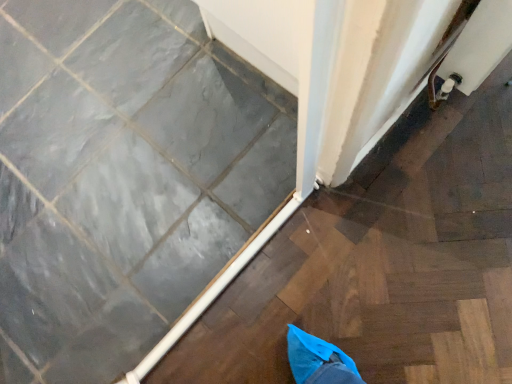
You are a GUI agent. You are given a task and a screenshot of the screen. Output one action in this format:
    pyautogui.click(x=<x>, y=<y>)
    Task: Click on the slate gray ceramic tile at lower left
    The width and height of the screenshot is (512, 384).
    Given the screenshot: What is the action you would take?
    pyautogui.click(x=123, y=178)

The width and height of the screenshot is (512, 384). Describe the element at coordinates (123, 178) in the screenshot. I see `slate gray ceramic tile at lower left` at that location.

What do you see at coordinates (384, 262) in the screenshot? This screenshot has height=384, width=512. I see `white glossy door at upper center` at bounding box center [384, 262].

Find the location of `white glossy door at upper center`. white glossy door at upper center is located at coordinates (384, 262).

Looking at this image, what is the approximate width of white glossy door at upper center?

It is 26.34 inches.

At what (x,y) coordinates should I click in order to perform the action: click on slate gray ceramic tile at lower left. Please return your answer as a coordinate pair (x, y). This screenshot has width=512, height=384. Looking at the image, I should click on (123, 178).

Between white glossy door at upper center and slate gray ceramic tile at lower left, which one appears on the right side from the viewer's perspective?

white glossy door at upper center is more to the right.

Is white glossy door at upper center positioned in front of slate gray ceramic tile at lower left?

That is True.

Considering the points (270, 366) and (232, 204), which point is in front, point (270, 366) or point (232, 204)?

The point (270, 366) is closer.

From the image's perspective, which one is positioned lower, white glossy door at upper center or slate gray ceramic tile at lower left?

white glossy door at upper center appears lower in the image.

From a real-world perspective, is white glossy door at upper center positioned under slate gray ceramic tile at lower left based on gravity?

Indeed, from a real-world perspective, white glossy door at upper center is positioned beneath slate gray ceramic tile at lower left.

In terms of width, does white glossy door at upper center look wider or thinner when compared to slate gray ceramic tile at lower left?

Clearly, white glossy door at upper center has less width compared to slate gray ceramic tile at lower left.

Who is taller, white glossy door at upper center or slate gray ceramic tile at lower left?

With more height is slate gray ceramic tile at lower left.

Who is bigger, white glossy door at upper center or slate gray ceramic tile at lower left?

Bigger between the two is slate gray ceramic tile at lower left.

Is white glossy door at upper center inside or outside of slate gray ceramic tile at lower left?

white glossy door at upper center is outside slate gray ceramic tile at lower left.

Would you say white glossy door at upper center is a long distance from slate gray ceramic tile at lower left?

No, white glossy door at upper center is in close proximity to slate gray ceramic tile at lower left.

Is white glossy door at upper center facing towards slate gray ceramic tile at lower left?

Yes, white glossy door at upper center is aimed at slate gray ceramic tile at lower left.

Measure the distance between white glossy door at upper center and slate gray ceramic tile at lower left.

white glossy door at upper center and slate gray ceramic tile at lower left are 15.63 inches apart from each other.

Identify the location of ceramic tile lying behind the white glossy door at upper center. (123, 178).

Between slate gray ceramic tile at lower left and white glossy door at upper center, which one appears on the right side from the viewer's perspective?

Positioned to the right is white glossy door at upper center.

Looking at this image, considering the positions of objects slate gray ceramic tile at lower left and white glossy door at upper center in the image provided, who is in front, slate gray ceramic tile at lower left or white glossy door at upper center?

Positioned in front is white glossy door at upper center.

Which is less distant, (21,239) or (459,213)?

Point (21,239).

From the image's perspective, is slate gray ceramic tile at lower left beneath white glossy door at upper center?

Incorrect, from the image's perspective, slate gray ceramic tile at lower left is higher than white glossy door at upper center.

From a real-world perspective, which object rests below the other?

white glossy door at upper center, from a real-world perspective.

Is slate gray ceramic tile at lower left wider than white glossy door at upper center?

Yes, slate gray ceramic tile at lower left is wider than white glossy door at upper center.

Can you confirm if slate gray ceramic tile at lower left is shorter than white glossy door at upper center?

In fact, slate gray ceramic tile at lower left may be taller than white glossy door at upper center.

Considering the relative sizes of slate gray ceramic tile at lower left and white glossy door at upper center in the image provided, is slate gray ceramic tile at lower left smaller than white glossy door at upper center?

Incorrect, slate gray ceramic tile at lower left is not smaller in size than white glossy door at upper center.

Is white glossy door at upper center completely or partially inside slate gray ceramic tile at lower left?

No, slate gray ceramic tile at lower left does not contain white glossy door at upper center.

In the scene shown: Is slate gray ceramic tile at lower left beside white glossy door at upper center?

No.

Does slate gray ceramic tile at lower left turn towards white glossy door at upper center?

No, slate gray ceramic tile at lower left is not turned towards white glossy door at upper center.

You are a GUI agent. You are given a task and a screenshot of the screen. Output one action in this format:
    pyautogui.click(x=<x>, y=<y>)
    Task: Click on the stairwell in front of the slate gray ceramic tile at lower left
    
    Given the screenshot: What is the action you would take?
    pyautogui.click(x=384, y=262)

There is a white glossy door at upper center. At what (x,y) coordinates should I click in order to perform the action: click on ceramic tile above it (from a real-world perspective). Please return your answer as a coordinate pair (x, y). The height and width of the screenshot is (384, 512). Looking at the image, I should click on (123, 178).

This screenshot has height=384, width=512. Find the location of `ceramic tile that is behind the white glossy door at upper center`. ceramic tile that is behind the white glossy door at upper center is located at coordinates (123, 178).